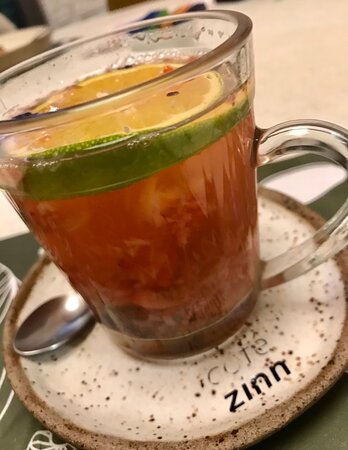
Identify the location of rim of mug. [x=199, y=67].